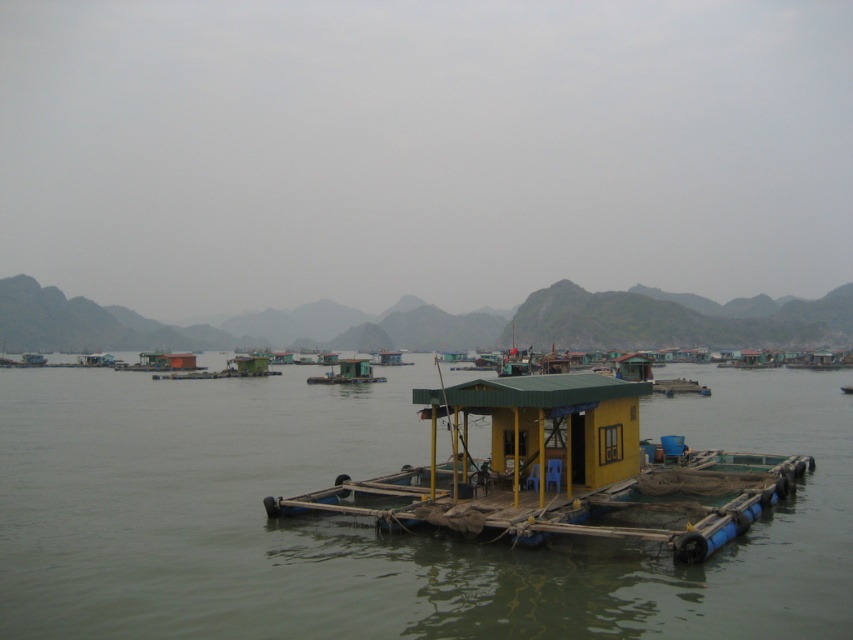
Does greenish-gray water at center lie in front of green matte houseboat at center?

Yes, it is in front of green matte houseboat at center.

What are the coordinates of `greenish-gray water at center` in the screenshot? It's located at pyautogui.click(x=370, y=529).

Is point (49, 433) farther from camera compared to point (424, 412)?

Yes, it is behind point (424, 412).

Who is taller, greenish-gray water at center or yellow matte houseboat at center?

yellow matte houseboat at center is taller.

Locate an element on the screen. The width and height of the screenshot is (853, 640). greenish-gray water at center is located at coordinates (370, 529).

The width and height of the screenshot is (853, 640). What are the coordinates of `greenish-gray water at center` in the screenshot? It's located at (370, 529).

In the scene shown: Which is more to the right, yellow matte houseboat at center or green matte houseboat at center?

Positioned to the right is yellow matte houseboat at center.

Is yellow matte houseboat at center further to the viewer compared to green matte houseboat at center?

No, yellow matte houseboat at center is in front of green matte houseboat at center.

Measure the distance between yellow matte houseboat at center and camera.

yellow matte houseboat at center is 46.82 feet away from camera.

Where is `yellow matte houseboat at center`? yellow matte houseboat at center is located at coordinates (561, 472).